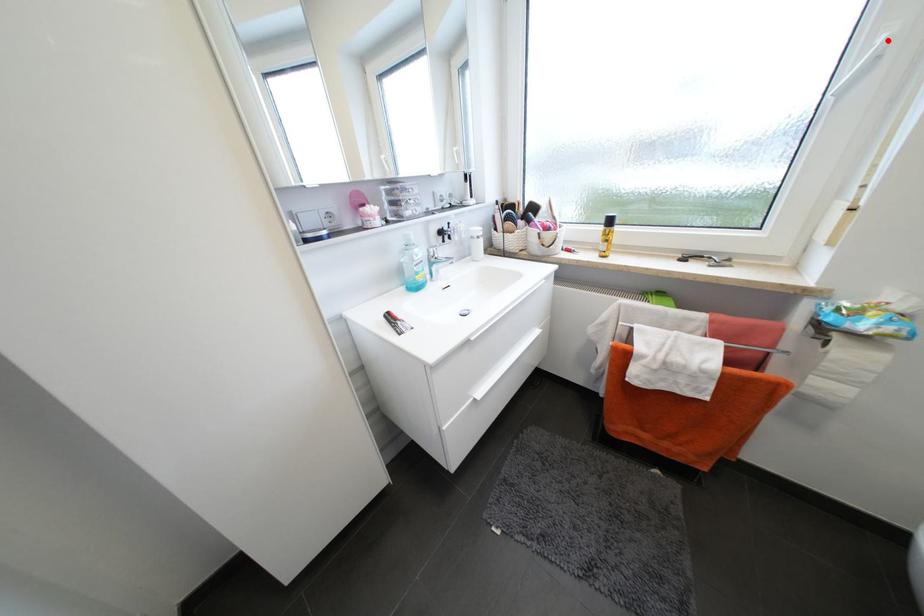
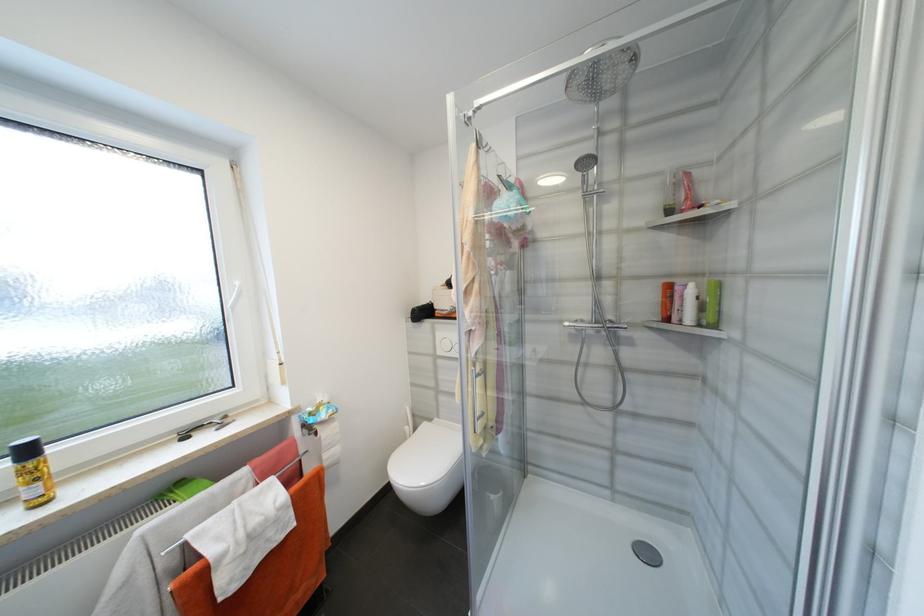
Locate, in the second image, the point that corresponds to the highlighted location in the first image.

(242, 285)